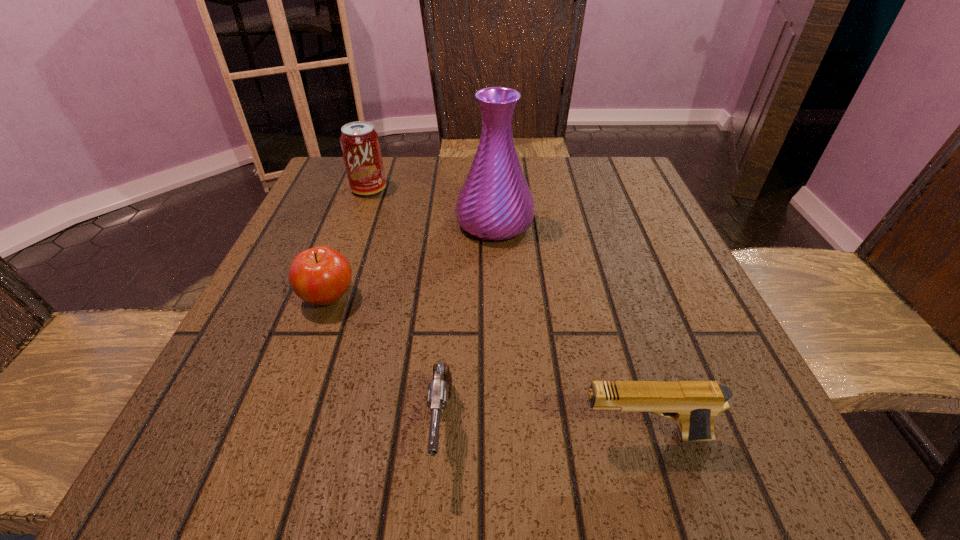
Where is `free area in between the apple and the soda can`? free area in between the apple and the soda can is located at coordinates (348, 244).

The image size is (960, 540). I want to click on vacant space that's between the second tallest object and the second farthest object, so click(432, 206).

I want to click on empty location between the second tallest object and the apple, so click(348, 244).

Where is `vacant region between the third farthest object and the farthest object`? vacant region between the third farthest object and the farthest object is located at coordinates (348, 244).

This screenshot has width=960, height=540. Identify the location of free space between the apple and the left pistol. (385, 363).

Image resolution: width=960 pixels, height=540 pixels. Identify the location of free area in between the soda can and the tallest object. (432, 206).

Identify the location of object identified as the fourth closest to the fourth nearest object. The height and width of the screenshot is (540, 960). pyautogui.click(x=693, y=404).

Choose which object is the second nearest neighbor to the soda can. Please provide its 2D coordinates. Your answer should be formatted as a tuple, i.e. [(x, y)], where the tuple contains the x and y coordinates of a point satisfying the conditions above.

[(321, 275)]

Locate an element on the screen. The image size is (960, 540). vacant space that satisfies the following two spatial constraints: 1. on the back side of the apple; 2. on the left side of the farthest object is located at coordinates (368, 189).